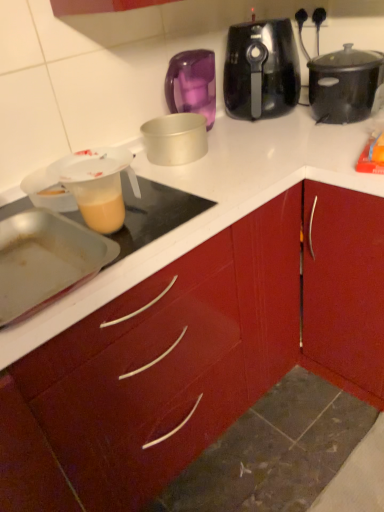
Question: From the image's perspective, is black matte slow cooker at upper right, arranged as the 2th slow cooker when viewed from the left, below black plastic slow cooker at upper center, acting as the 1th slow cooker starting from the left?

Choices:
 (A) yes
 (B) no

Answer: (A)

Question: Is black matte slow cooker at upper right, arranged as the 2th slow cooker when viewed from the left, to the right of black plastic slow cooker at upper center, acting as the 1th slow cooker starting from the left, from the viewer's perspective?

Choices:
 (A) yes
 (B) no

Answer: (A)

Question: From a real-world perspective, is black matte slow cooker at upper right, arranged as the 2th slow cooker when viewed from the left, physically below black plastic slow cooker at upper center, marked as the second slow cooker in a right-to-left arrangement?

Choices:
 (A) yes
 (B) no

Answer: (A)

Question: Could black plastic slow cooker at upper center, acting as the 1th slow cooker starting from the left, be considered to be inside black matte slow cooker at upper right, which appears as the first slow cooker when viewed from the right?

Choices:
 (A) no
 (B) yes

Answer: (A)

Question: Does black matte slow cooker at upper right, which appears as the first slow cooker when viewed from the right, have a greater height compared to black plastic slow cooker at upper center, marked as the second slow cooker in a right-to-left arrangement?

Choices:
 (A) yes
 (B) no

Answer: (B)

Question: Considering their positions, is black plastic slow cooker at upper center, marked as the second slow cooker in a right-to-left arrangement, located in front of or behind black matte slow cooker at upper right, which appears as the first slow cooker when viewed from the right?

Choices:
 (A) front
 (B) behind

Answer: (B)

Question: Visually, is black plastic slow cooker at upper center, acting as the 1th slow cooker starting from the left, positioned to the left or to the right of black matte slow cooker at upper right, which appears as the first slow cooker when viewed from the right?

Choices:
 (A) right
 (B) left

Answer: (B)

Question: Considering the positions of black plastic slow cooker at upper center, acting as the 1th slow cooker starting from the left, and black matte slow cooker at upper right, which appears as the first slow cooker when viewed from the right, in the image, is black plastic slow cooker at upper center, acting as the 1th slow cooker starting from the left, wider or thinner than black matte slow cooker at upper right, which appears as the first slow cooker when viewed from the right,?

Choices:
 (A) thin
 (B) wide

Answer: (A)

Question: In terms of size, does black plastic slow cooker at upper center, marked as the second slow cooker in a right-to-left arrangement, appear bigger or smaller than black matte slow cooker at upper right, arranged as the 2th slow cooker when viewed from the left?

Choices:
 (A) big
 (B) small

Answer: (A)

Question: From the image's perspective, is black plastic slow cooker at upper center, marked as the second slow cooker in a right-to-left arrangement, above or below silver metallic cake pan at center, which is the third kitchen appliance in bottom-to-top order?

Choices:
 (A) above
 (B) below

Answer: (A)

Question: In the image, is black plastic slow cooker at upper center, acting as the 1th slow cooker starting from the left, on the left side or the right side of silver metallic cake pan at center, which is the third kitchen appliance in bottom-to-top order?

Choices:
 (A) left
 (B) right

Answer: (B)

Question: Looking at the image, does black plastic slow cooker at upper center, marked as the second slow cooker in a right-to-left arrangement, seem bigger or smaller compared to silver metallic cake pan at center, arranged as the first kitchen appliance when viewed from the back?

Choices:
 (A) small
 (B) big

Answer: (B)

Question: In terms of width, does black plastic slow cooker at upper center, marked as the second slow cooker in a right-to-left arrangement, look wider or thinner when compared to silver metallic cake pan at center, the 3th kitchen appliance positioned from the front?

Choices:
 (A) wide
 (B) thin

Answer: (A)

Question: Considering the relative positions of translucent plastic measuring cup at left, the 2th kitchen appliance positioned from the bottom, and black matte slow cooker at upper right, which appears as the first slow cooker when viewed from the right, in the image provided, is translucent plastic measuring cup at left, the 2th kitchen appliance positioned from the bottom, to the left or to the right of black matte slow cooker at upper right, which appears as the first slow cooker when viewed from the right,?

Choices:
 (A) right
 (B) left

Answer: (B)

Question: Does point (114, 157) appear closer or farther from the camera than point (312, 80)?

Choices:
 (A) farther
 (B) closer

Answer: (B)